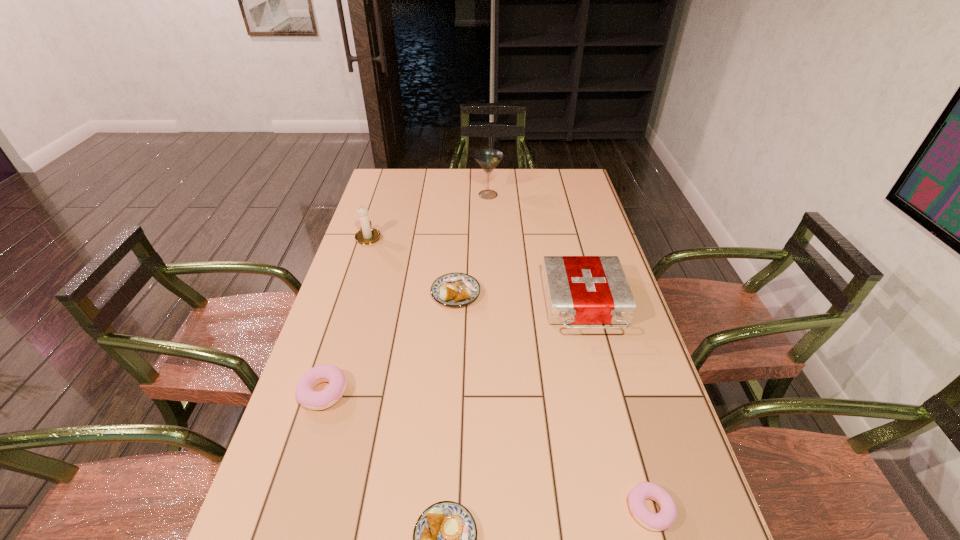
At what (x,y) coordinates should I click in order to perform the action: click on the tallest object. Please return your answer as a coordinate pair (x, y). This screenshot has height=540, width=960. Looking at the image, I should click on (488, 159).

You are a GUI agent. You are given a task and a screenshot of the screen. Output one action in this format:
    pyautogui.click(x=<x>, y=<y>)
    Task: Click on the farthest object
    Image resolution: width=960 pixels, height=540 pixels.
    Given the screenshot: What is the action you would take?
    pyautogui.click(x=488, y=159)

Identify the location of candle holder. The image size is (960, 540). pyautogui.click(x=368, y=235).

Locate an element on the screen. This screenshot has height=540, width=960. white candle holder is located at coordinates (368, 235).

The width and height of the screenshot is (960, 540). I want to click on the fifth shortest object, so point(578,289).

At what (x,y) coordinates should I click in order to perform the action: click on red first-aid kit. Please return your answer as a coordinate pair (x, y). The width and height of the screenshot is (960, 540). Looking at the image, I should click on (578, 289).

The width and height of the screenshot is (960, 540). I want to click on the bigger brown pastry, so click(453, 289).

Where is `the farther brown pastry`? the farther brown pastry is located at coordinates (453, 289).

The height and width of the screenshot is (540, 960). Find the location of `the left pink pastry`. the left pink pastry is located at coordinates (306, 396).

The width and height of the screenshot is (960, 540). Find the location of `the farther pink pastry`. the farther pink pastry is located at coordinates (306, 396).